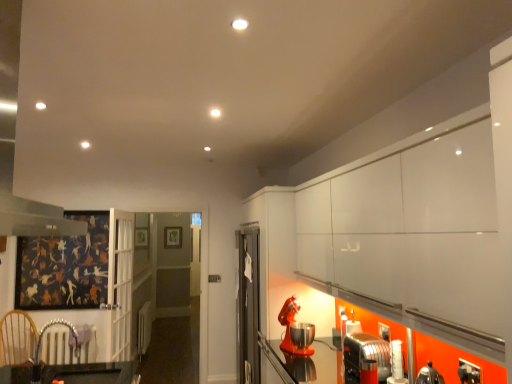
The width and height of the screenshot is (512, 384). Describe the element at coordinates (50, 326) in the screenshot. I see `wooden armchair at lower left` at that location.

Describe the element at coordinates (366, 354) in the screenshot. This screenshot has height=384, width=512. I see `metallic silver toaster at lower right, marked as the 1th appliance in a right-to-left arrangement` at that location.

Where is `wooden armchair at lower left`? wooden armchair at lower left is located at coordinates (50, 326).

Can you confirm if wooden armchair at lower left is thinner than orange matte stand mixer at lower right, which is the 2th appliance in front-to-back order?

Incorrect, the width of wooden armchair at lower left is not less than that of orange matte stand mixer at lower right, which is the 2th appliance in front-to-back order.

Considering the sizes of wooden armchair at lower left and orange matte stand mixer at lower right, the first appliance positioned from the back, in the image, is wooden armchair at lower left taller or shorter than orange matte stand mixer at lower right, the first appliance positioned from the back,?

Considering their sizes, wooden armchair at lower left has less height than orange matte stand mixer at lower right, the first appliance positioned from the back.

Locate an element on the screen. The image size is (512, 384). armchair above the orange matte stand mixer at lower right, which is the 2th appliance in front-to-back order (from the image's perspective) is located at coordinates (50, 326).

Are wooden armchair at lower left and orange matte stand mixer at lower right, positioned as the second appliance in right-to-left order, located far from each other?

Absolutely, wooden armchair at lower left is distant from orange matte stand mixer at lower right, positioned as the second appliance in right-to-left order.

Is orange matte stand mixer at lower right, positioned as the second appliance in right-to-left order, positioned far away from metallic silver toaster at lower right, the 2th appliance from the back?

No, there isn't a large distance between orange matte stand mixer at lower right, positioned as the second appliance in right-to-left order, and metallic silver toaster at lower right, the 2th appliance from the back.

What's the angular difference between orange matte stand mixer at lower right, positioned as the second appliance in right-to-left order, and metallic silver toaster at lower right, the 2th appliance from the back,'s facing directions?

The facing directions of orange matte stand mixer at lower right, positioned as the second appliance in right-to-left order, and metallic silver toaster at lower right, the 2th appliance from the back, are 13.3 degrees apart.

Who is smaller, orange matte stand mixer at lower right, which is the 2th appliance in front-to-back order, or metallic silver toaster at lower right, the 2th appliance from the back?

Smaller between the two is metallic silver toaster at lower right, the 2th appliance from the back.

Considering the relative positions of orange matte stand mixer at lower right, which is the 2th appliance in front-to-back order, and wooden armchair at lower left in the image provided, is orange matte stand mixer at lower right, which is the 2th appliance in front-to-back order, in front of wooden armchair at lower left?

No, orange matte stand mixer at lower right, which is the 2th appliance in front-to-back order, is behind wooden armchair at lower left.

From a real-world perspective, is orange matte stand mixer at lower right, positioned as the second appliance in right-to-left order, over wooden armchair at lower left?

Yes, from a real-world perspective, orange matte stand mixer at lower right, positioned as the second appliance in right-to-left order, is on top of wooden armchair at lower left.

What's the angular difference between orange matte stand mixer at lower right, which is the 2th appliance in front-to-back order, and wooden armchair at lower left's facing directions?

165 degrees separate the facing orientations of orange matte stand mixer at lower right, which is the 2th appliance in front-to-back order, and wooden armchair at lower left.

Which is farther from the camera, [302,334] or [40,342]?

Point [40,342]

Can you tell me how much metallic silver toaster at lower right, the first appliance when ordered from front to back, and orange matte stand mixer at lower right, which is the 2th appliance in front-to-back order, differ in facing direction?

The angle between the facing direction of metallic silver toaster at lower right, the first appliance when ordered from front to back, and the facing direction of orange matte stand mixer at lower right, which is the 2th appliance in front-to-back order, is 13.3 degrees.

Is metallic silver toaster at lower right, the first appliance when ordered from front to back, looking in the opposite direction of orange matte stand mixer at lower right, positioned as the second appliance in right-to-left order?

That's not correct — metallic silver toaster at lower right, the first appliance when ordered from front to back, is not looking away from orange matte stand mixer at lower right, positioned as the second appliance in right-to-left order.

Is metallic silver toaster at lower right, the 2th appliance from the back, taller than orange matte stand mixer at lower right, which is the 2th appliance in front-to-back order?

In fact, metallic silver toaster at lower right, the 2th appliance from the back, may be shorter than orange matte stand mixer at lower right, which is the 2th appliance in front-to-back order.

From the image's perspective, who appears lower, metallic silver toaster at lower right, the first appliance when ordered from front to back, or orange matte stand mixer at lower right, which is the 2th appliance in front-to-back order?

metallic silver toaster at lower right, the first appliance when ordered from front to back.

Is metallic silver toaster at lower right, the 2th appliance from the back, oriented towards wooden armchair at lower left?

Yes, metallic silver toaster at lower right, the 2th appliance from the back, is facing wooden armchair at lower left.

From a real-world perspective, relative to wooden armchair at lower left, is metallic silver toaster at lower right, the first appliance when ordered from front to back, vertically above or below?

From a real-world perspective, metallic silver toaster at lower right, the first appliance when ordered from front to back, is physically below wooden armchair at lower left.

Which object is wider, metallic silver toaster at lower right, the 2th appliance from the back, or wooden armchair at lower left?

wooden armchair at lower left.

Where is `armchair on the left side of metallic silver toaster at lower right, the first appliance when ordered from front to back`? This screenshot has width=512, height=384. armchair on the left side of metallic silver toaster at lower right, the first appliance when ordered from front to back is located at coordinates (50, 326).

Is wooden armchair at lower left bigger than metallic silver toaster at lower right, which is the 2th appliance from left to right?

Actually, wooden armchair at lower left might be smaller than metallic silver toaster at lower right, which is the 2th appliance from left to right.

Can you confirm if wooden armchair at lower left is thinner than metallic silver toaster at lower right, marked as the 1th appliance in a right-to-left arrangement?

In fact, wooden armchair at lower left might be wider than metallic silver toaster at lower right, marked as the 1th appliance in a right-to-left arrangement.

Is metallic silver toaster at lower right, the 2th appliance from the back, located within wooden armchair at lower left?

No.

From the image's perspective, starting from the wooden armchair at lower left, which appliance is the 1st one below? Please provide its 2D coordinates.

[(295, 330)]

The width and height of the screenshot is (512, 384). I want to click on appliance behind the metallic silver toaster at lower right, marked as the 1th appliance in a right-to-left arrangement, so click(x=295, y=330).

Looking at the image, which one is located further to metallic silver toaster at lower right, marked as the 1th appliance in a right-to-left arrangement, wooden armchair at lower left or orange matte stand mixer at lower right, positioned as the second appliance in right-to-left order?

The object further to metallic silver toaster at lower right, marked as the 1th appliance in a right-to-left arrangement, is wooden armchair at lower left.

Looking at the image, which one is located closer to metallic silver toaster at lower right, the 2th appliance from the back, orange matte stand mixer at lower right, the first appliance positioned from the back, or wooden armchair at lower left?

Based on the image, orange matte stand mixer at lower right, the first appliance positioned from the back, appears to be nearer to metallic silver toaster at lower right, the 2th appliance from the back.

Considering their positions, is orange matte stand mixer at lower right, the first appliance positioned from the back, positioned closer to wooden armchair at lower left than metallic silver toaster at lower right, the first appliance when ordered from front to back?

Based on the image, orange matte stand mixer at lower right, the first appliance positioned from the back, appears to be nearer to wooden armchair at lower left.

Looking at the image, which one is located further to orange matte stand mixer at lower right, the first appliance positioned from the back, metallic silver toaster at lower right, which is the 2th appliance from left to right, or wooden armchair at lower left?

Based on the image, wooden armchair at lower left appears to be further to orange matte stand mixer at lower right, the first appliance positioned from the back.

Considering their positions, is metallic silver toaster at lower right, which is the 2th appliance from left to right, positioned further to wooden armchair at lower left than orange matte stand mixer at lower right, the first appliance positioned from the back?

The object further to wooden armchair at lower left is metallic silver toaster at lower right, which is the 2th appliance from left to right.

Estimate the real-world distances between objects in this image. Which object is closer to orange matte stand mixer at lower right, which is the 2th appliance in front-to-back order, wooden armchair at lower left or metallic silver toaster at lower right, the 2th appliance from the back?

Among the two, metallic silver toaster at lower right, the 2th appliance from the back, is located nearer to orange matte stand mixer at lower right, which is the 2th appliance in front-to-back order.

Where is `appliance situated between wooden armchair at lower left and metallic silver toaster at lower right, the first appliance when ordered from front to back, from left to right`? appliance situated between wooden armchair at lower left and metallic silver toaster at lower right, the first appliance when ordered from front to back, from left to right is located at coordinates (295, 330).